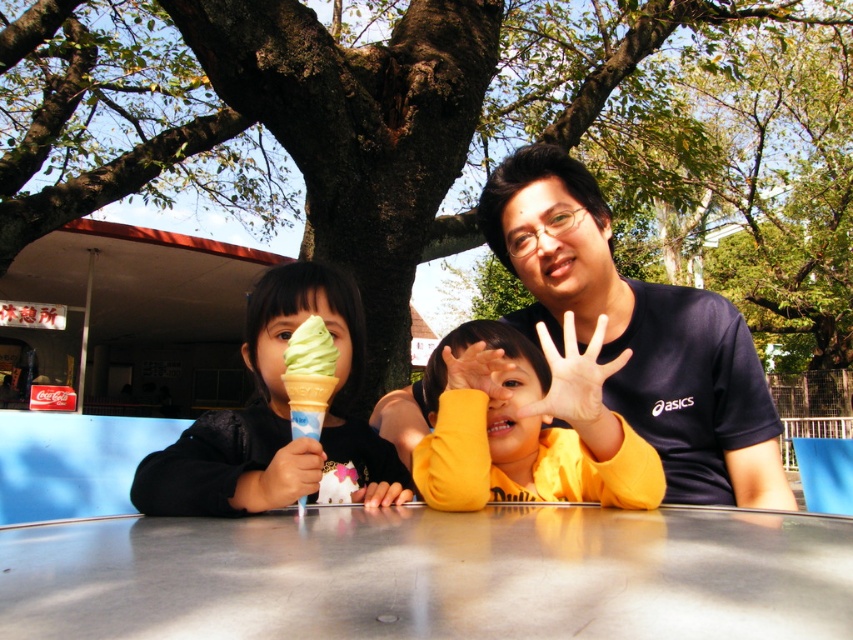
Question: From the image, what is the correct spatial relationship of dark blue t-shirt at center in relation to yellow matte/yellowish-orange fabric at center?

Choices:
 (A) right
 (B) left

Answer: (A)

Question: Is metallic silver table at center below dark blue t-shirt at center?

Choices:
 (A) no
 (B) yes

Answer: (B)

Question: Considering the real-world distances, which object is farthest from the green matte ice cream cone at left?

Choices:
 (A) dark blue t-shirt at center
 (B) green ice cream cone at left

Answer: (A)

Question: Which point is farther to the camera?

Choices:
 (A) (300, 435)
 (B) (527, 488)

Answer: (B)

Question: Is dark blue t-shirt at center thinner than green matte ice cream cone at left?

Choices:
 (A) no
 (B) yes

Answer: (A)

Question: Which object is farther from the camera taking this photo?

Choices:
 (A) dark blue t-shirt at center
 (B) green matte ice cream cone at left

Answer: (A)